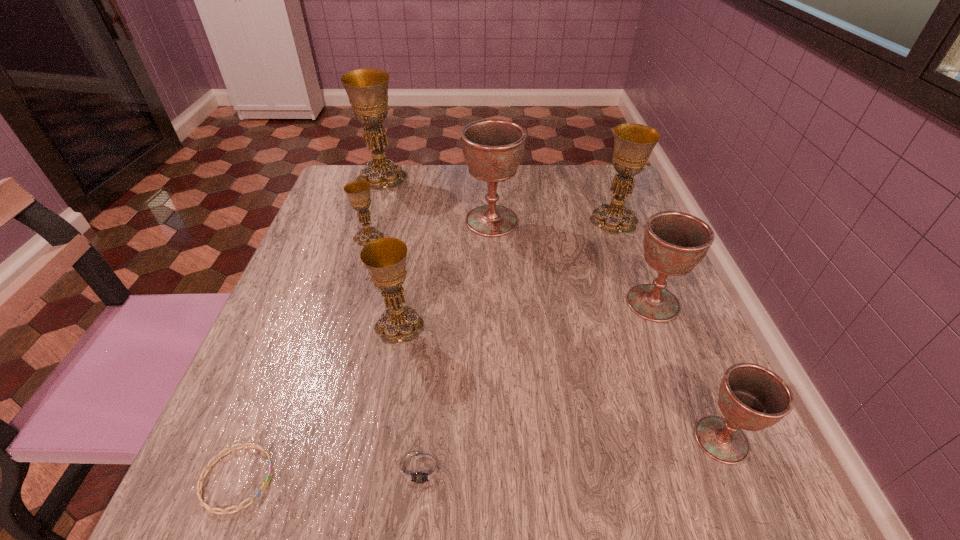
In the image, there is a desktop. Where is `vacant space at the near edge`? Image resolution: width=960 pixels, height=540 pixels. vacant space at the near edge is located at coordinates (348, 514).

Where is `vacant space at the left edge of the desktop`? The height and width of the screenshot is (540, 960). vacant space at the left edge of the desktop is located at coordinates (327, 217).

Locate an element on the screen. The height and width of the screenshot is (540, 960). vacant space at the right edge of the desktop is located at coordinates (605, 292).

In the image, there is a desktop. At what (x,y) coordinates should I click in order to perform the action: click on free region at the far left corner. Please return your answer as a coordinate pair (x, y). Looking at the image, I should click on (391, 192).

I want to click on vacant area at the near left corner, so tap(256, 488).

Where is `vacant space at the far right corner of the desktop`? The width and height of the screenshot is (960, 540). vacant space at the far right corner of the desktop is located at coordinates (575, 208).

The width and height of the screenshot is (960, 540). What are the coordinates of `vacant area between the bracelet and the rightmost gold chalice` in the screenshot? It's located at (425, 349).

Find the location of a particular element. free spot between the nearest brown chalice and the rightmost gold chalice is located at coordinates (667, 330).

The image size is (960, 540). I want to click on free point between the biggest brown chalice and the smallest gold chalice, so click(430, 230).

I want to click on vacant point located between the smallest gold chalice and the second farthest brown chalice, so click(511, 271).